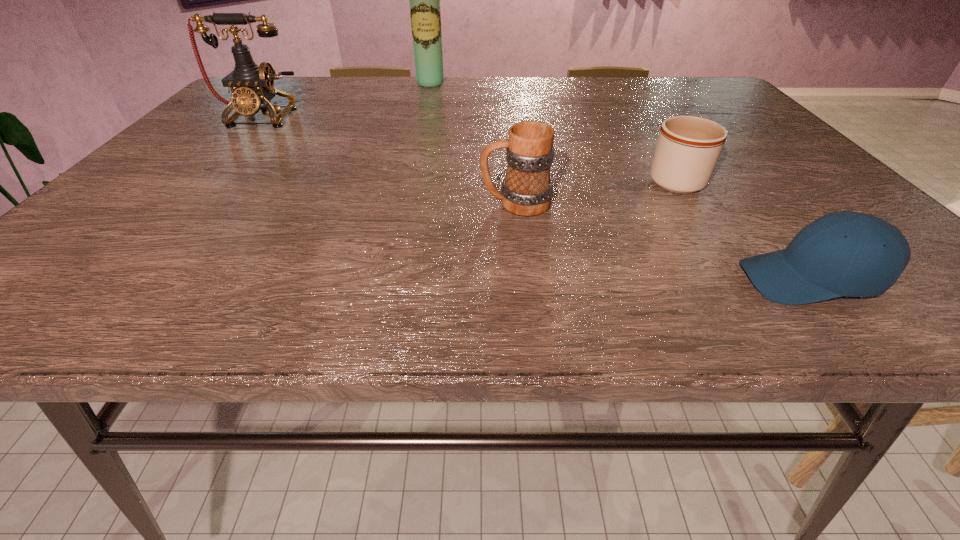
The image size is (960, 540). Identify the location of free space between the second object from left to right and the telephone. (346, 100).

This screenshot has height=540, width=960. In order to click on empty space that is in between the shorter mug and the second tallest object in this screenshot , I will do `click(467, 147)`.

Identify the location of empty space that is in between the right mug and the taller mug. (595, 190).

Where is `free space that is in between the right mug and the taller mug`? This screenshot has height=540, width=960. free space that is in between the right mug and the taller mug is located at coordinates (595, 190).

Locate an element on the screen. This screenshot has height=540, width=960. free space between the shorter mug and the telephone is located at coordinates (467, 147).

Locate an element on the screen. This screenshot has width=960, height=540. free space between the nearest object and the left mug is located at coordinates (661, 241).

The width and height of the screenshot is (960, 540). I want to click on free space between the shorter mug and the nearest object, so click(x=740, y=228).

At what (x,y) coordinates should I click in order to perform the action: click on object that can be found as the third closest to the wine bottle. Please return your answer as a coordinate pair (x, y). The width and height of the screenshot is (960, 540). Looking at the image, I should click on (688, 147).

Image resolution: width=960 pixels, height=540 pixels. What are the coordinates of `object that is the closest to the nearest object` in the screenshot? It's located at (688, 147).